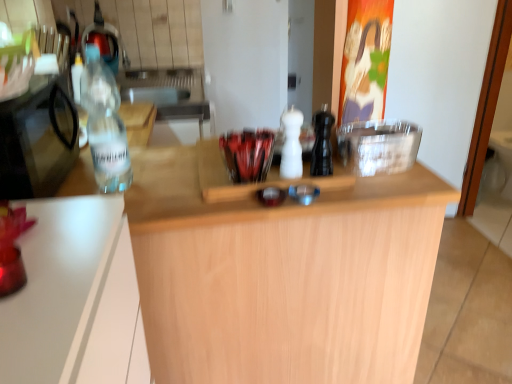
This screenshot has width=512, height=384. I want to click on empty space that is in between clear glass bottle at left, the 3th bottle positioned from the right, and white matte salt shaker at center, which is the 2th bottle in left-to-right order, so click(x=180, y=177).